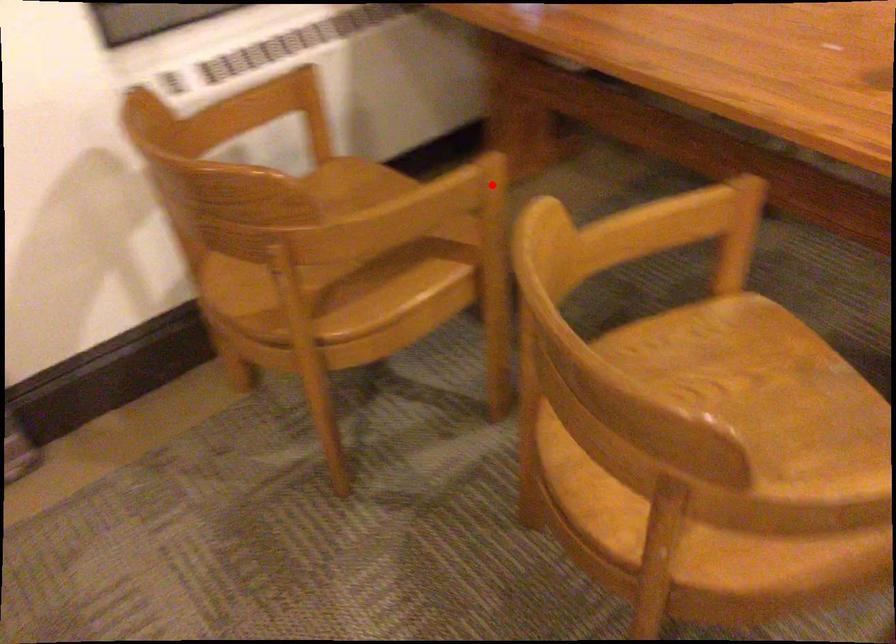
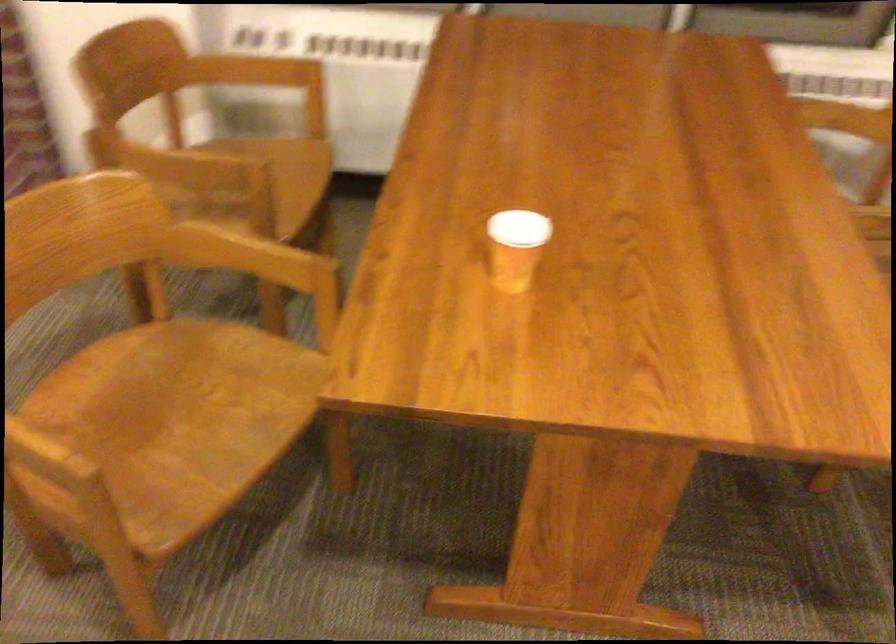
Question: I am providing you with two images of the same scene from different viewpoints. Given a red point in image1, look at the same physical point in image2. Is it:

Choices:
 (A) Closer to the viewpoint
 (B) Farther from the viewpoint

Answer: (B)